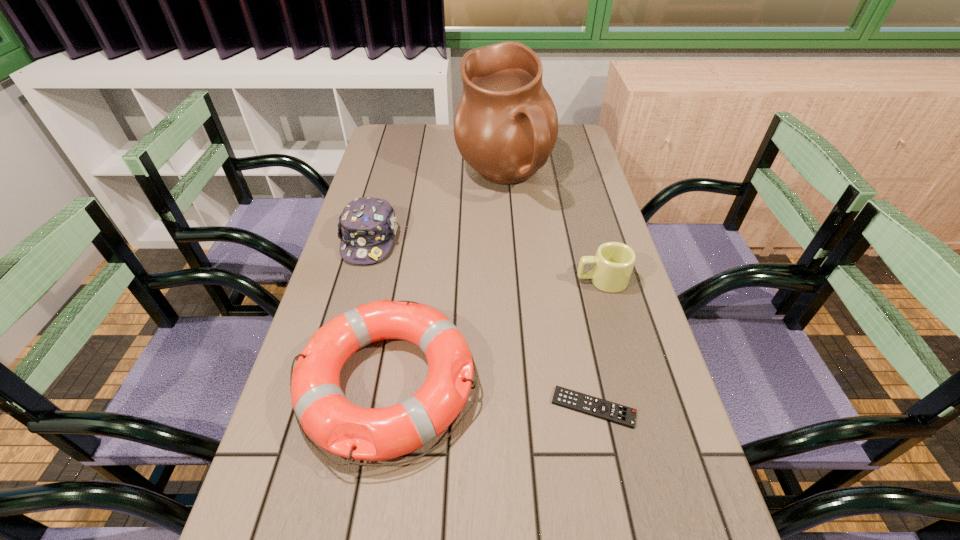
The image size is (960, 540). In order to click on free space in the image that satisfies the following two spatial constraints: 1. with the handle on the side of the third farthest object; 2. on the front side of the shortest object in this screenshot , I will do `click(636, 407)`.